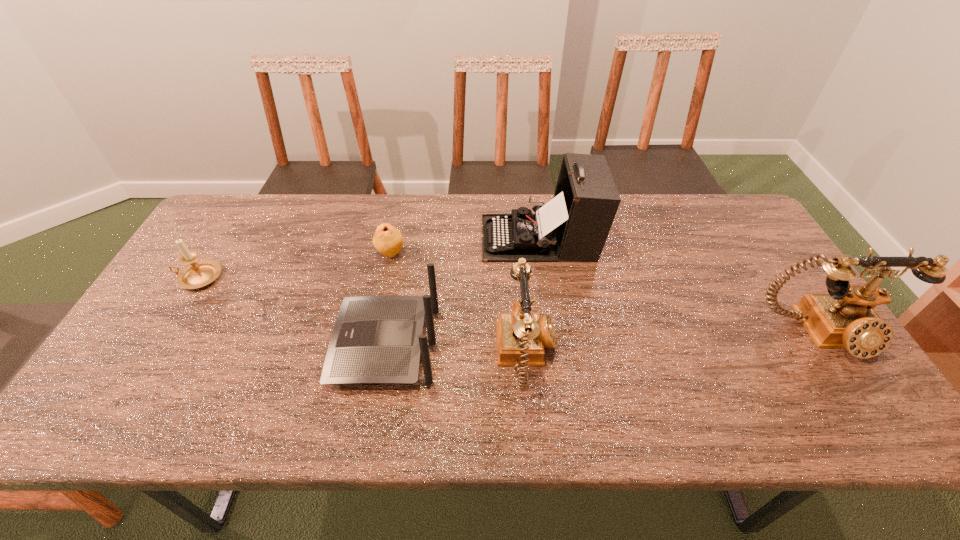
Identify the location of empty location between the right telephone and the left telephone. (675, 345).

This screenshot has width=960, height=540. Identify the location of free space between the typewriter and the taller telephone. (681, 286).

Locate an element on the screen. The width and height of the screenshot is (960, 540). free space that is in between the shorter telephone and the typewriter is located at coordinates (534, 297).

Locate an element on the screen. This screenshot has height=540, width=960. vacant point located between the second shortest object and the typewriter is located at coordinates (369, 258).

In order to click on free space between the shorter telephone and the typewriter in this screenshot , I will do `click(534, 297)`.

Where is `unoccupied position between the typewriter and the pear`? The height and width of the screenshot is (540, 960). unoccupied position between the typewriter and the pear is located at coordinates (465, 246).

At what (x,y) coordinates should I click in order to perform the action: click on object that can be found as the fifth closest to the router. Please return your answer as a coordinate pair (x, y). The width and height of the screenshot is (960, 540). Looking at the image, I should click on pyautogui.click(x=845, y=318).

Select which object is the second closest to the typewriter. Please provide its 2D coordinates. Your answer should be formatted as a tuple, i.e. [(x, y)], where the tuple contains the x and y coordinates of a point satisfying the conditions above.

[(376, 339)]

Locate an element on the screen. The image size is (960, 540). free space that satisfies the following two spatial constraints: 1. on the dial number of the rightmost object; 2. on the front-facing side of the third shortest object is located at coordinates (829, 345).